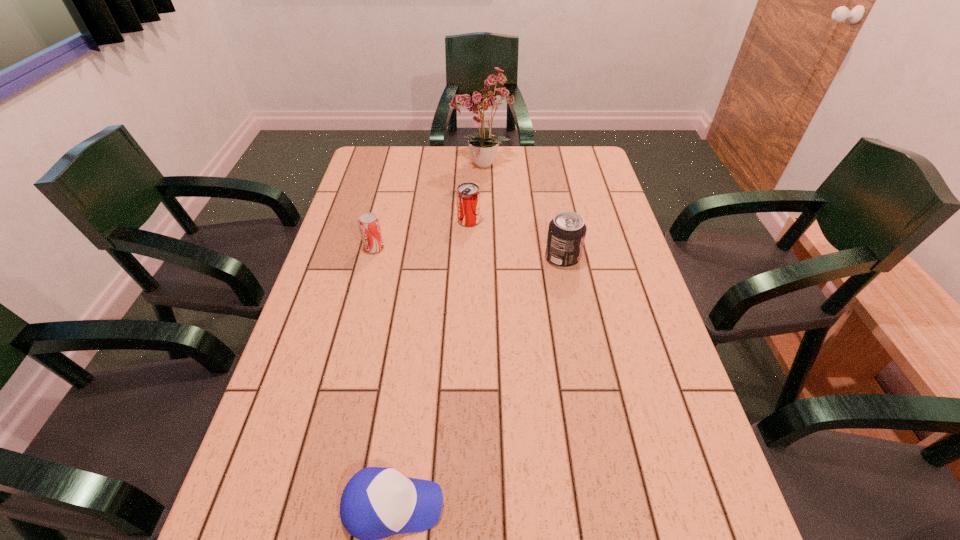
I want to click on vacant space that satisfies the following two spatial constraints: 1. on the front-facing side of the flower arrangement; 2. on the left side of the rightmost soda can, so click(482, 258).